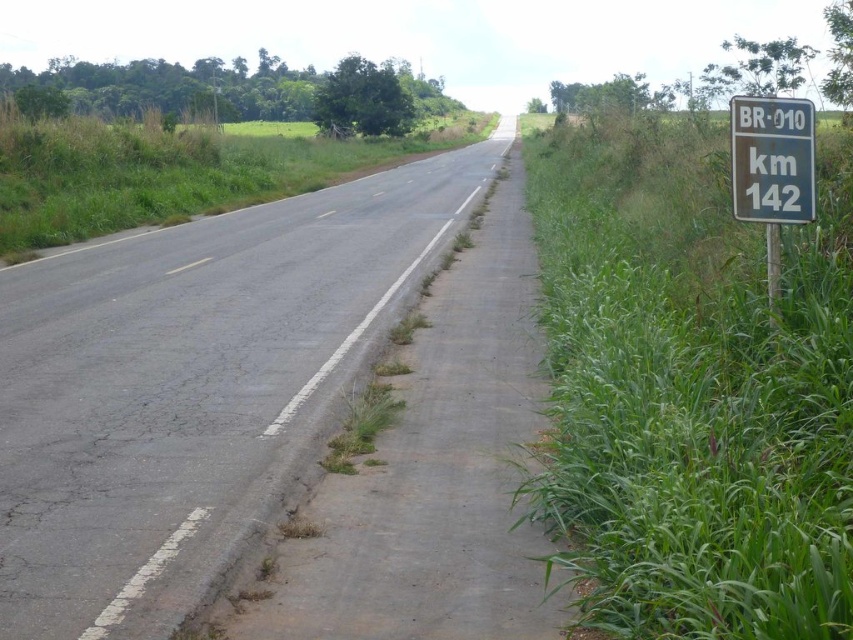
Does green grass at right appear under asphalt road at center?

Incorrect, green grass at right is not positioned below asphalt road at center.

Who is more distant from viewer, [781,353] or [247,413]?

The point [247,413] is behind.

Between point (726, 330) and point (44, 397), which one is positioned in front?

Point (726, 330) is in front.

Locate an element on the screen. green grass at right is located at coordinates (693, 387).

Is asphalt road at center further to the viewer compared to green grass at center?

No.

Is asphalt road at center smaller than green grass at center?

Correct, asphalt road at center occupies less space than green grass at center.

You are a GUI agent. You are given a task and a screenshot of the screen. Output one action in this format:
    pyautogui.click(x=<x>, y=<y>)
    Task: Click on the asphalt road at center
    
    Given the screenshot: What is the action you would take?
    pyautogui.click(x=192, y=385)

Does point (808, 541) lie behind point (376, 163)?

That is False.

Looking at this image, is green grass at right bigger than green grass at center?

No, green grass at right is not bigger than green grass at center.

The image size is (853, 640). In order to click on green grass at right in this screenshot , I will do `click(693, 387)`.